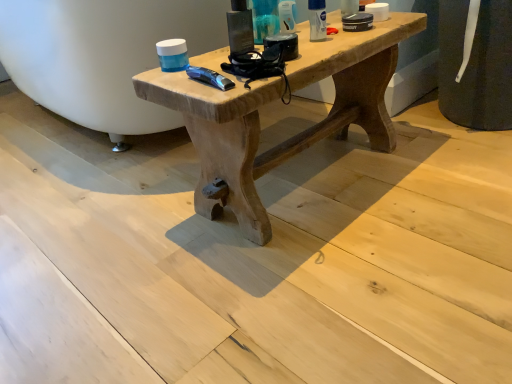
The image size is (512, 384). I want to click on free point in front of white matte deodorant at upper right, positioned as the third toiletry in left-to-right order, so [x=312, y=49].